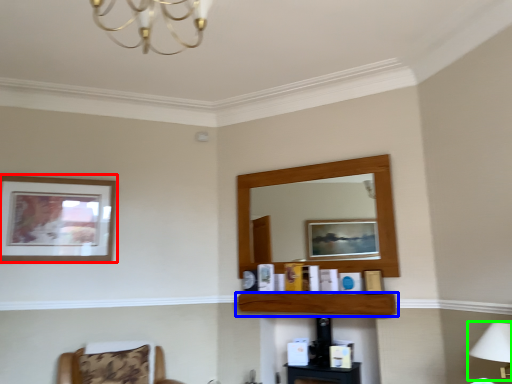
Question: Considering the real-world distances, which object is closest to picture frame (highlighted by a red box)? shelf (highlighted by a blue box) or table lamp (highlighted by a green box).

Choices:
 (A) shelf
 (B) table lamp

Answer: (A)